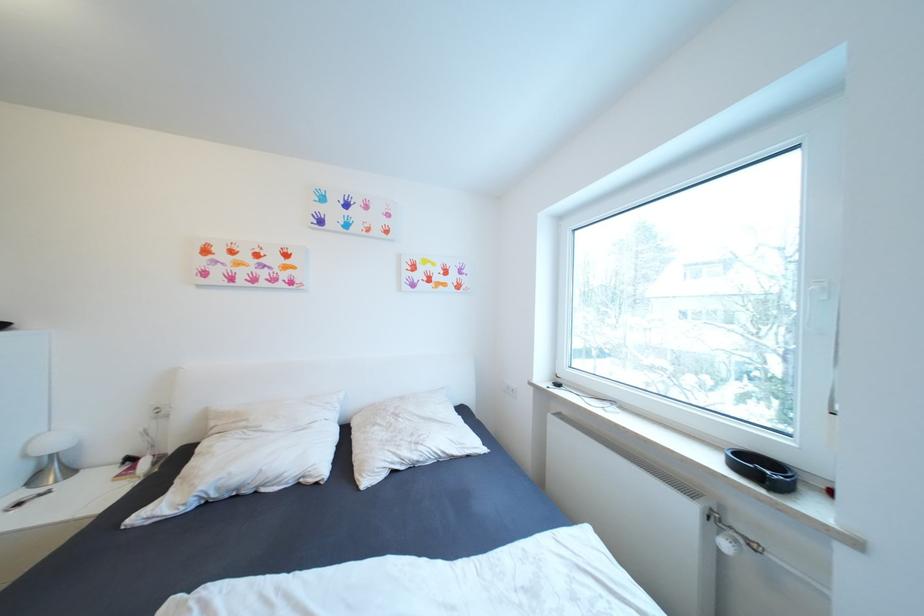
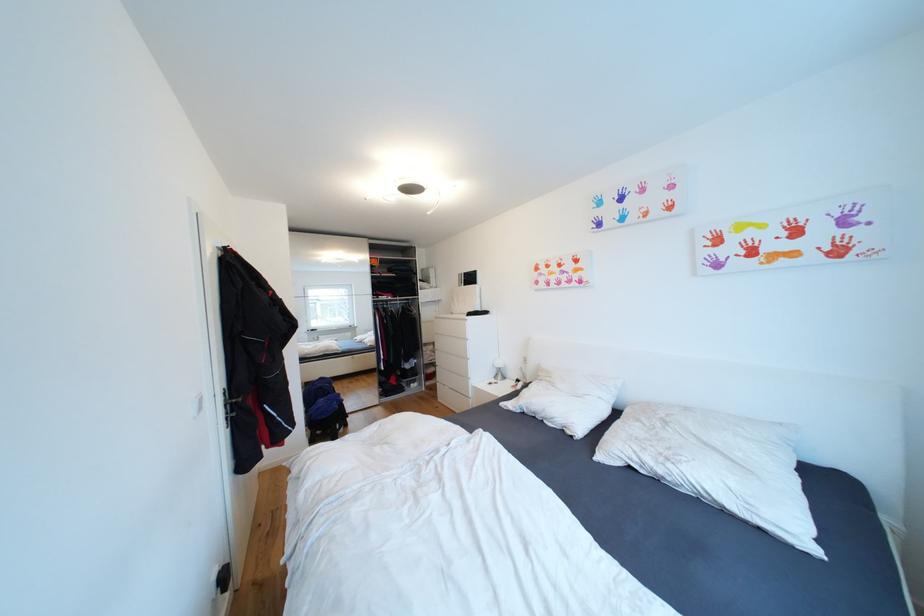
Where in the second image is the point corresponding to (42,480) from the first image?

(503, 378)